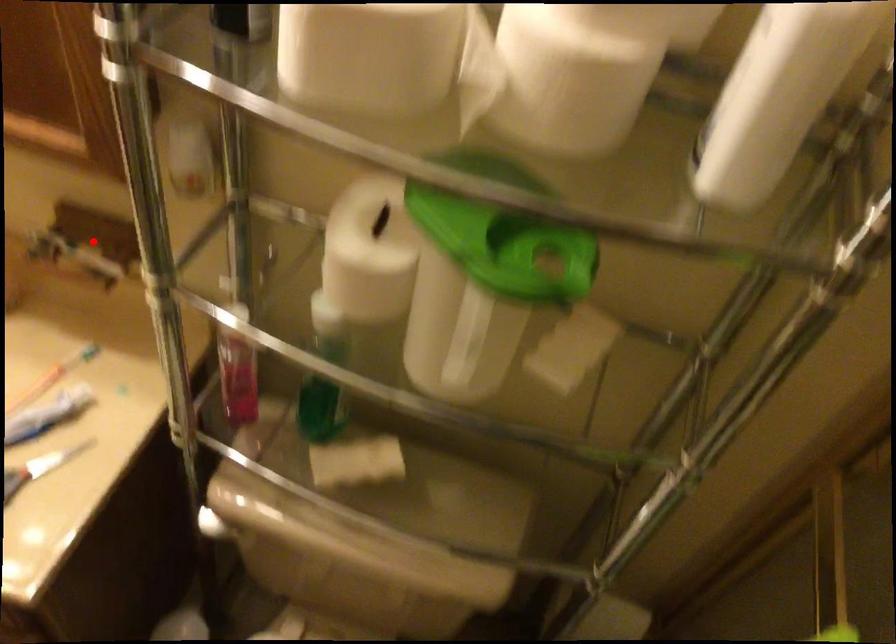
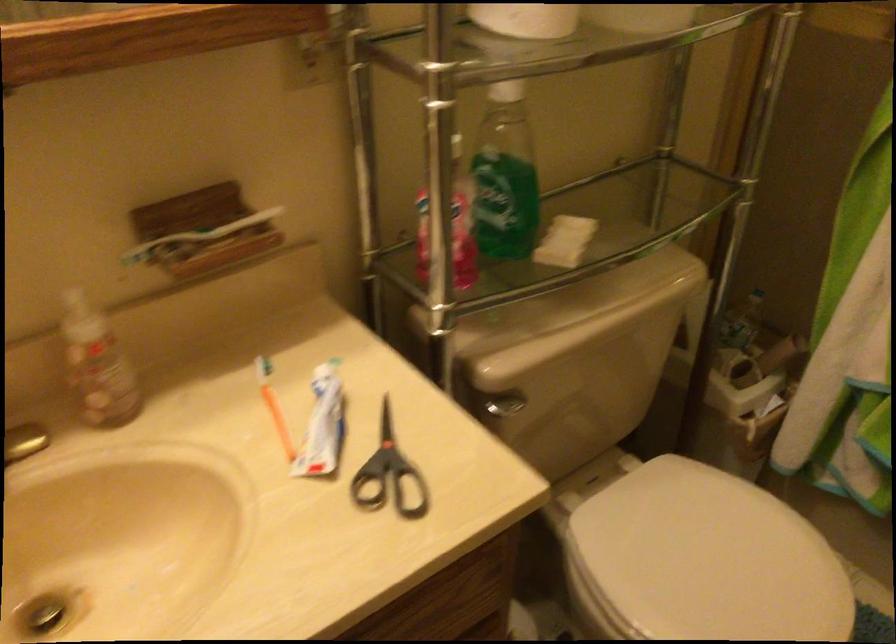
Where in the second image is the point corresponding to the highlighted location from the first image?

(212, 230)